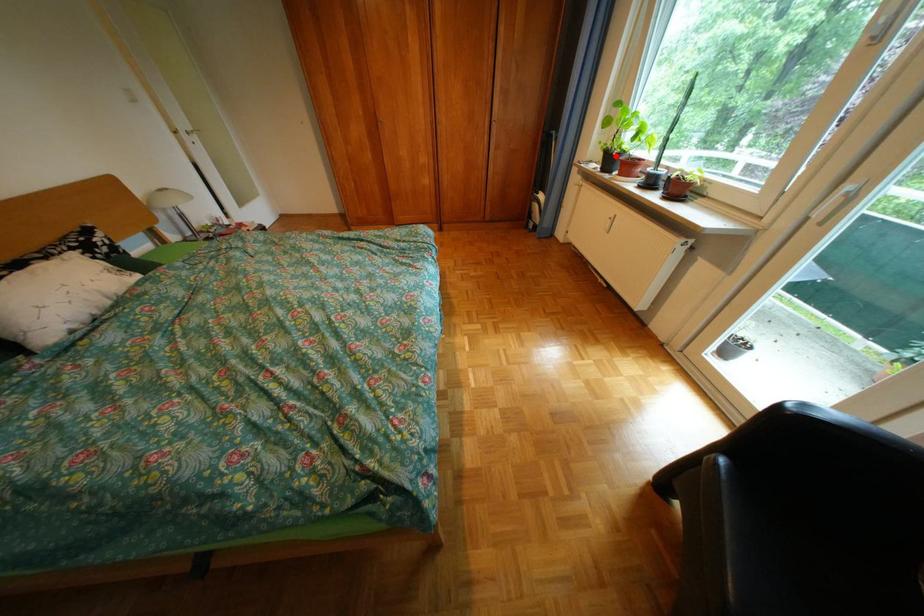
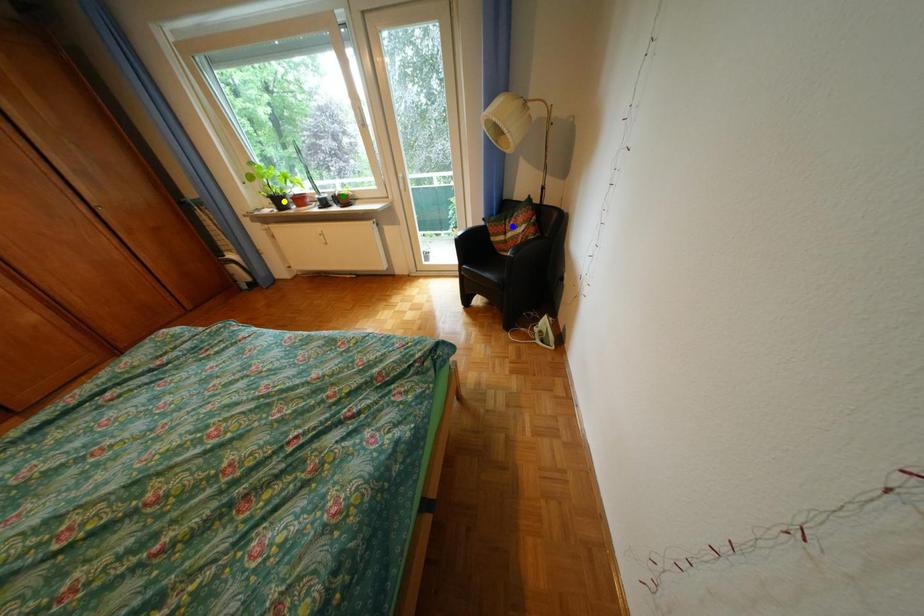
Question: I am providing you with two images of the same scene from different viewpoints. A red point is marked on the first image. You are given multiple points on the second image. Which spot in image 2 lines up with the point in image 1?

Choices:
 (A) yellow point
 (B) blue point
 (C) green point

Answer: (A)